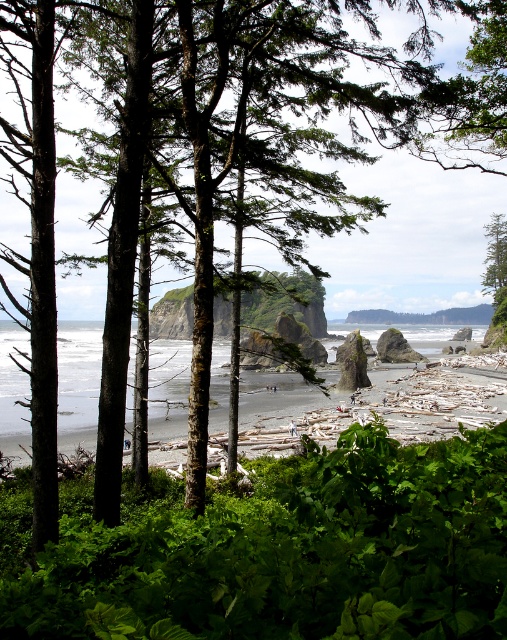
Question: Can you confirm if green leafy shrubs at center is positioned above green rough bark tree at upper right?

Choices:
 (A) no
 (B) yes

Answer: (A)

Question: Is green leafy shrubs at center closer to the viewer compared to green rough bark tree at upper right?

Choices:
 (A) no
 (B) yes

Answer: (B)

Question: Among these objects, which one is farthest from the camera?

Choices:
 (A) green leafy shrubs at center
 (B) green rough bark tree at upper right

Answer: (B)

Question: Which of the following is the closest to the observer?

Choices:
 (A) green leafy shrubs at center
 (B) green rough bark tree at upper right

Answer: (A)

Question: Can you confirm if green leafy shrubs at center is positioned above green rough bark tree at upper right?

Choices:
 (A) no
 (B) yes

Answer: (A)

Question: Among these objects, which one is farthest from the camera?

Choices:
 (A) green rough bark tree at upper right
 (B) green leafy shrubs at center

Answer: (A)